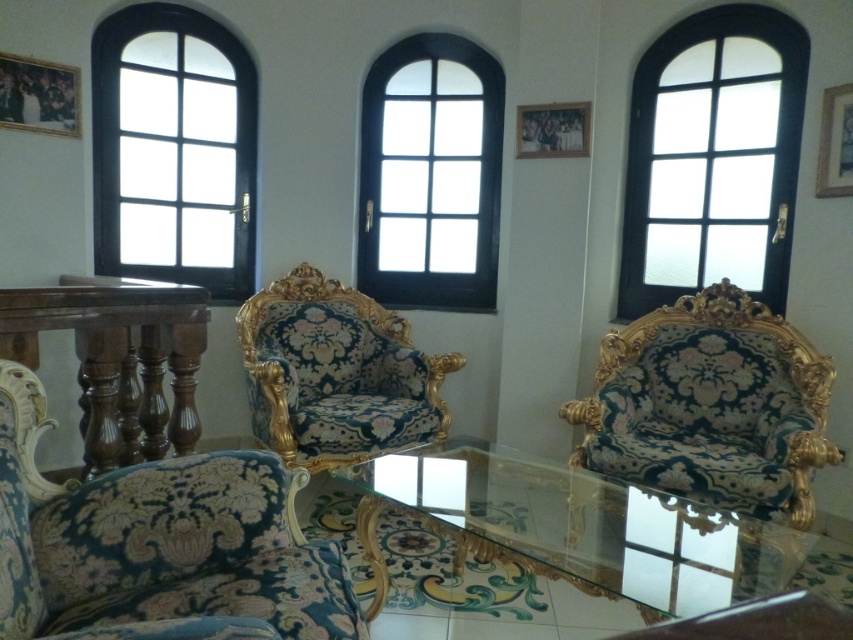
You are standing in the living room and want to place a large potted plant exactly at the center of the room. Considering the matte black window at upper right, which is located at coordinates point 0.247, 0.837, can you determine if the plant will be positioned closer to the window or the opposite wall?

The matte black window at upper right is located at coordinates point [712,157]. Since the center of the room is typically at the midpoint between walls, placing the plant at the center would mean it is equidistant from all walls, including the wall with the window. However, the window is positioned closer to the upper right corner, so the plant at the center would be farther from the window than the opposite wall.